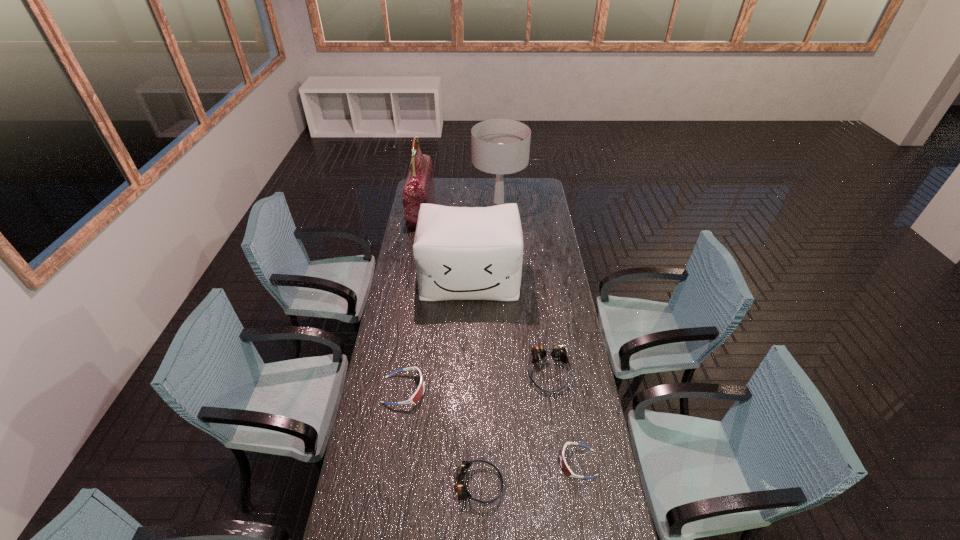
Identify the location of the shortest object. This screenshot has width=960, height=540. (566, 469).

Identify the location of the shortest goggles. (566, 469).

Where is `free space located 0.330m on the front-facing side of the brown lampshade`? free space located 0.330m on the front-facing side of the brown lampshade is located at coordinates (502, 251).

The image size is (960, 540). I want to click on vacant space situated on the front-facing side of the handbag, so click(x=470, y=211).

Locate an element on the screen. The width and height of the screenshot is (960, 540). vacant space located 0.150m on the side of the white cushion with the smiley face is located at coordinates (468, 328).

The width and height of the screenshot is (960, 540). What are the coordinates of `free spot located through the lenses of the farther bronze goggles` in the screenshot? It's located at (559, 445).

This screenshot has width=960, height=540. I want to click on vacant space located on the front-facing side of the leftmost goggles, so click(x=493, y=390).

Identify the location of free region located 0.310m through the lenses of the nearer bronze goggles. (596, 484).

The image size is (960, 540). In order to click on vacant space located on the front-facing side of the shortest object in this screenshot , I will do `click(475, 463)`.

Find the location of a particular element. This screenshot has height=540, width=960. vacant space positioned 0.390m on the front-facing side of the shortest object is located at coordinates (446, 463).